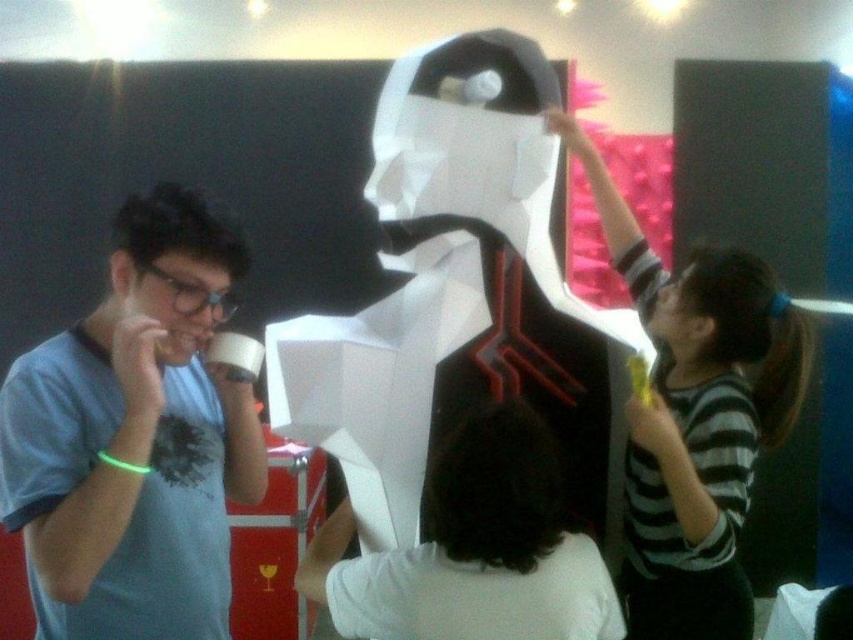
You are standing at the origin point of the coordinate system. The white paper sculpture at center is located at point 0.463, 0.531. If you want to move directly towards the sculpture, which direction should you head?

Since the white paper sculpture at center is located at coordinates 0.463 on the x axis and 0.531 on the y axis, you should move northeast to reach it.

Consider the image. You are standing in front of the sculpture and want to touch the point at coordinates point [15,433] and point [703,342]. Which point will require you to reach further away from your body?

Point [703,342] will require you to reach further away from your body because it is farther from the viewer compared to point [15,433].